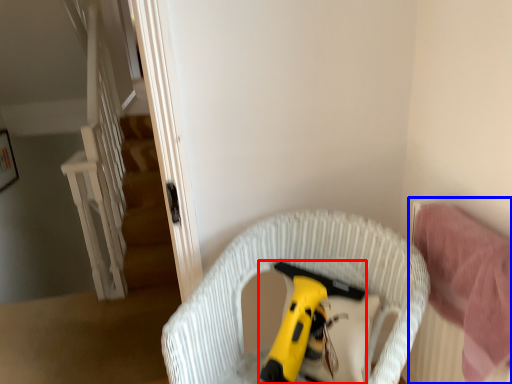
Question: Among these objects, which one is farthest to the camera, toy (highlighted by a red box) or bed (highlighted by a blue box)?

Choices:
 (A) toy
 (B) bed

Answer: (A)